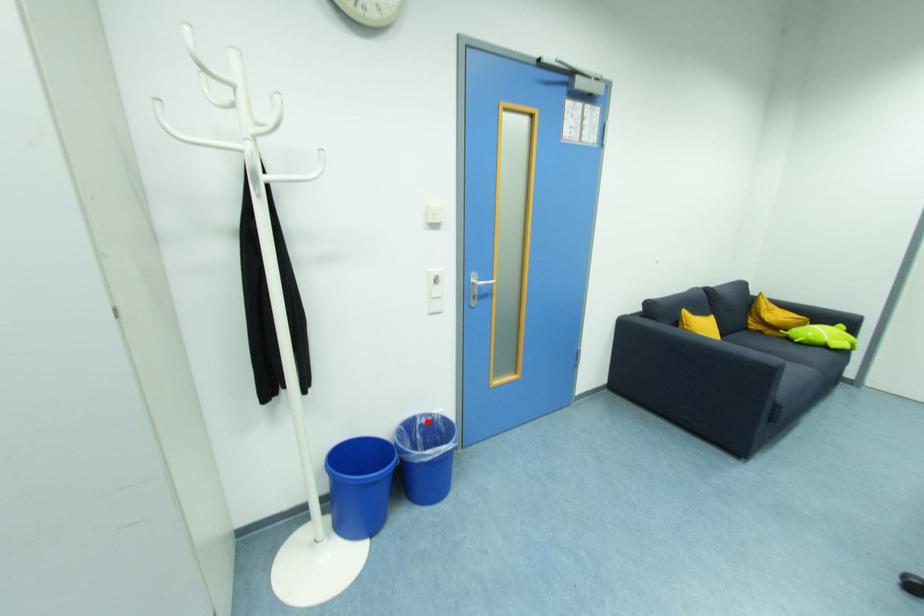
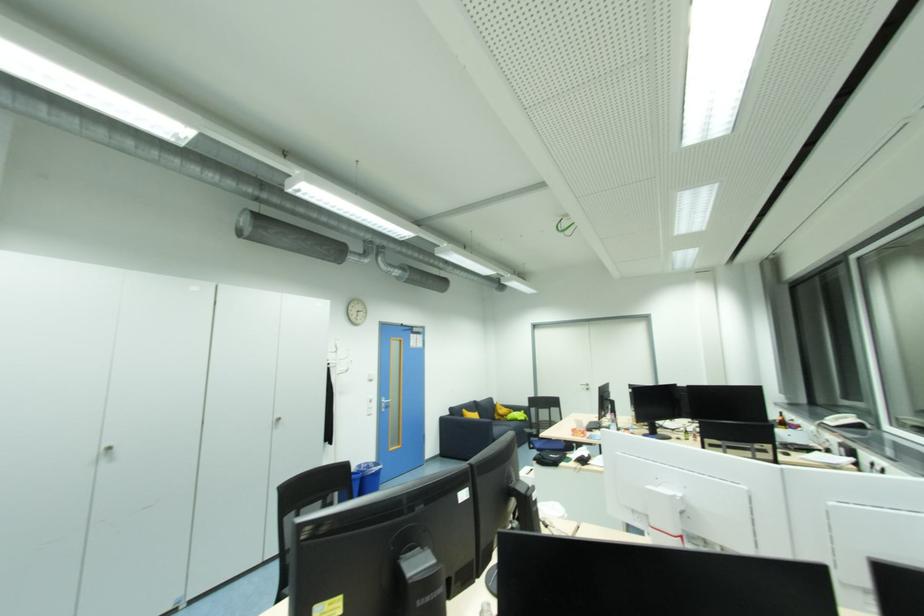
Where in the second image is the point corresponding to the highlighted location from the first image?

(369, 466)